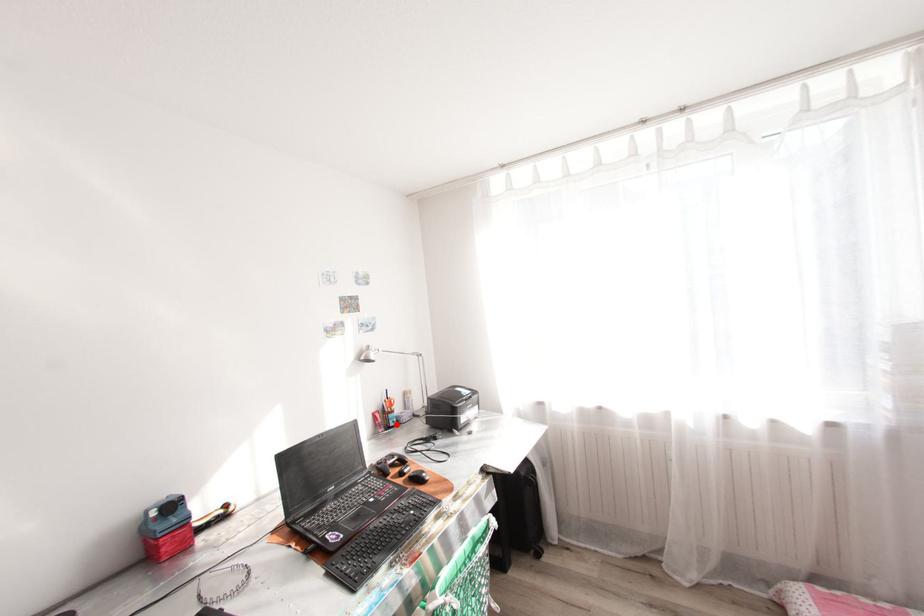
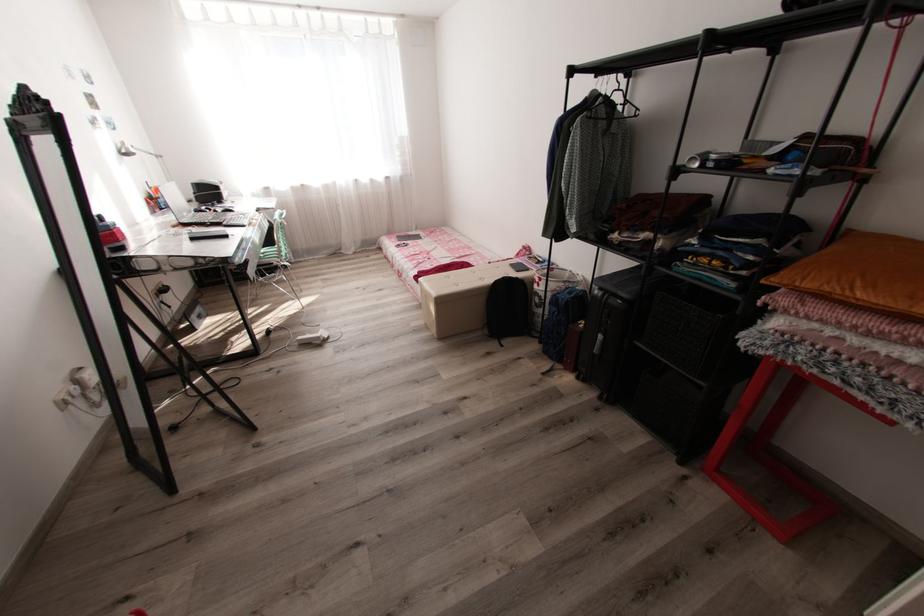
Find the pixel in the second image that matches the highlighted location in the first image.

(167, 207)